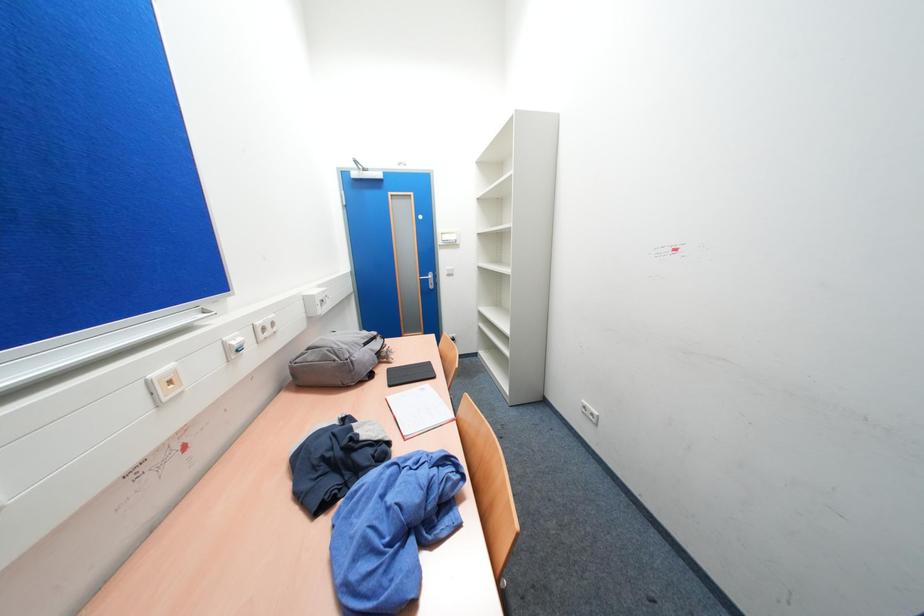
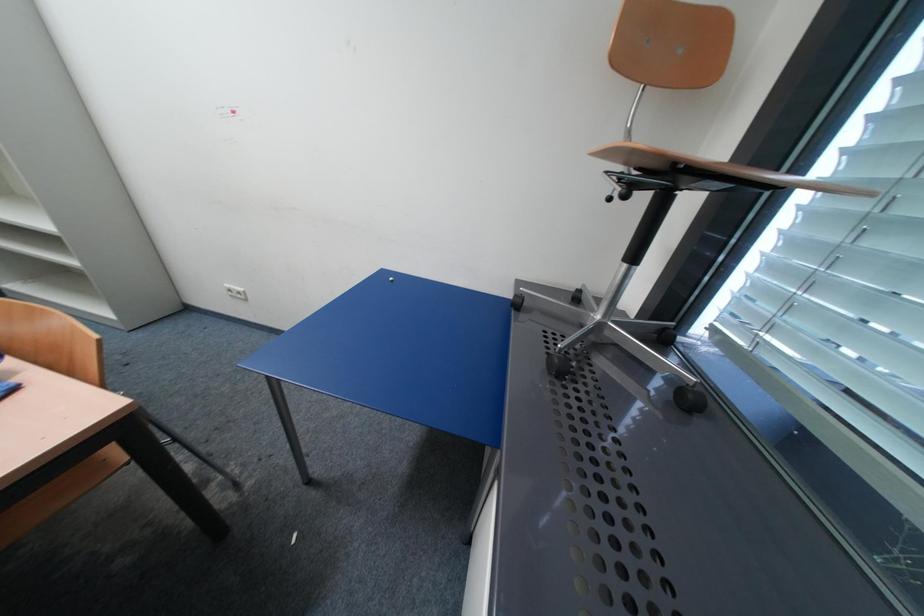
The first image is from the beginning of the video and the second image is from the end. How did the camera likely rotate when shooting the video?

The rotation direction of the camera is right-down.